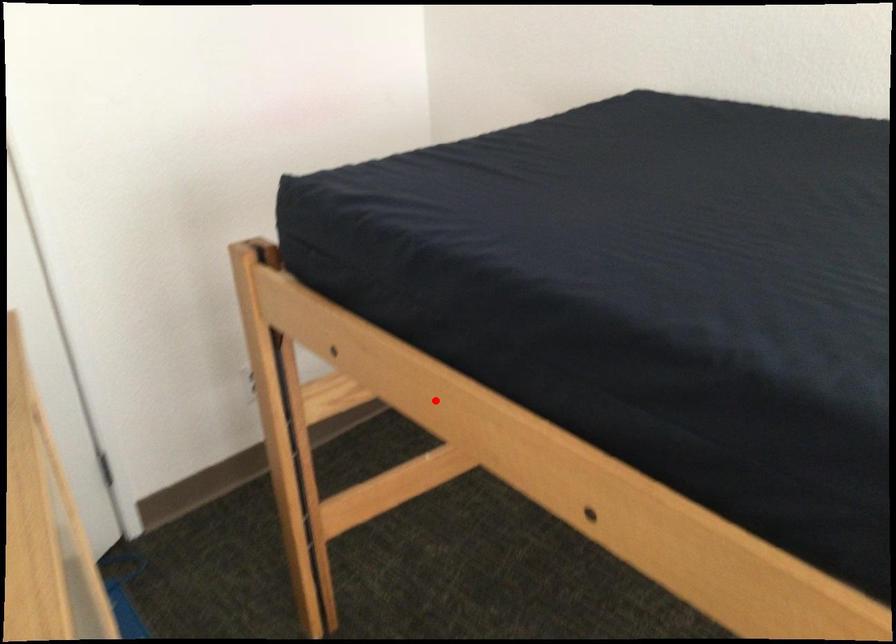
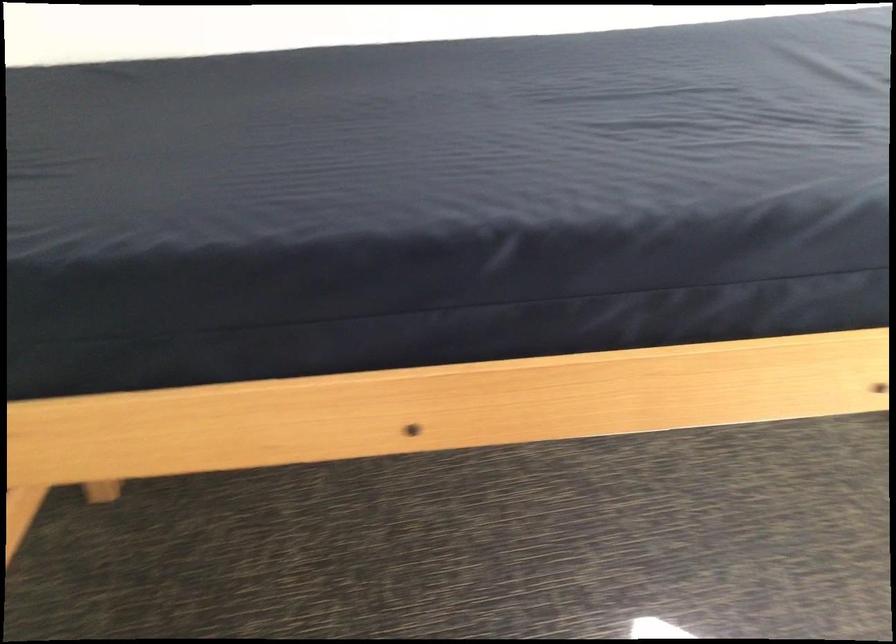
Question: I am providing you with two images of the same scene from different viewpoints. Image1 has a red point marked. In image2, the corresponding 3D location appears at what relative position? Reply with the corresponding letter.

Choices:
 (A) Closer
 (B) Farther

Answer: (A)